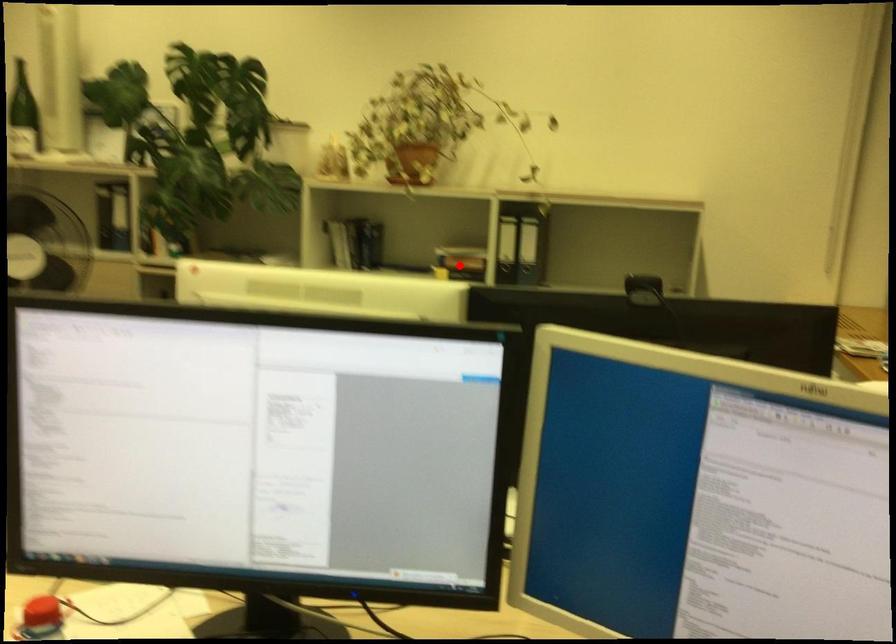
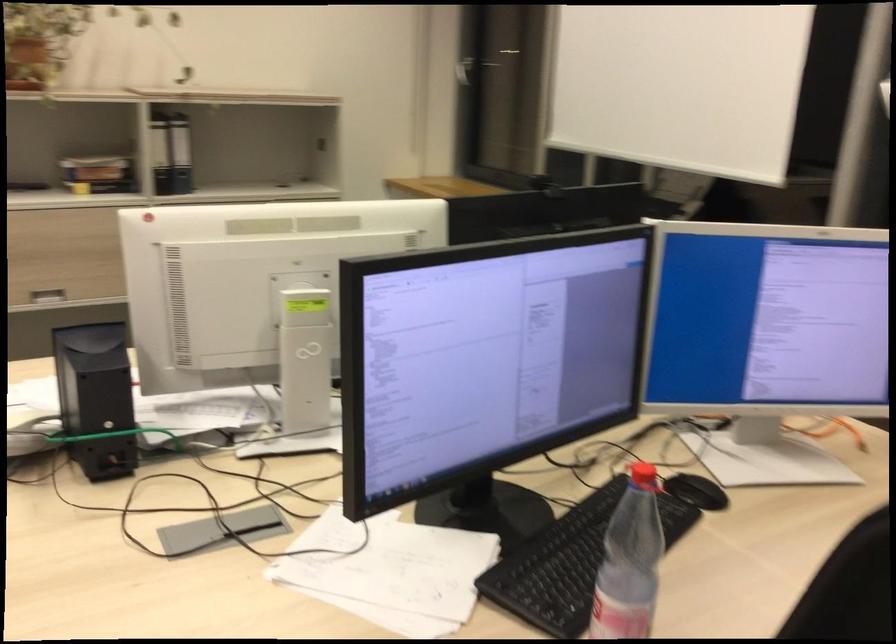
Question: I am providing you with two images of the same scene from different viewpoints. Given a red point in image1, look at the same physical point in image2. Is it:

Choices:
 (A) Closer to the viewpoint
 (B) Farther from the viewpoint

Answer: (A)